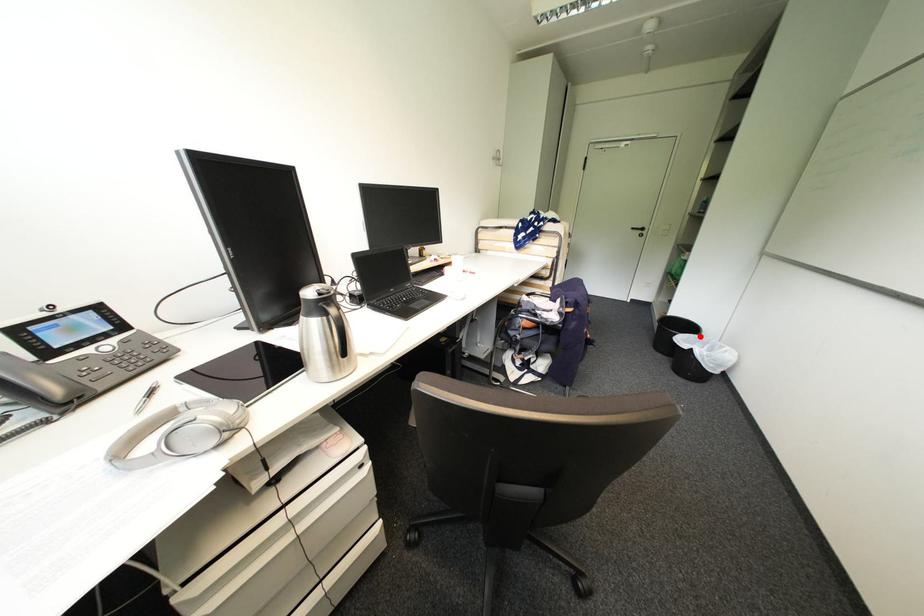
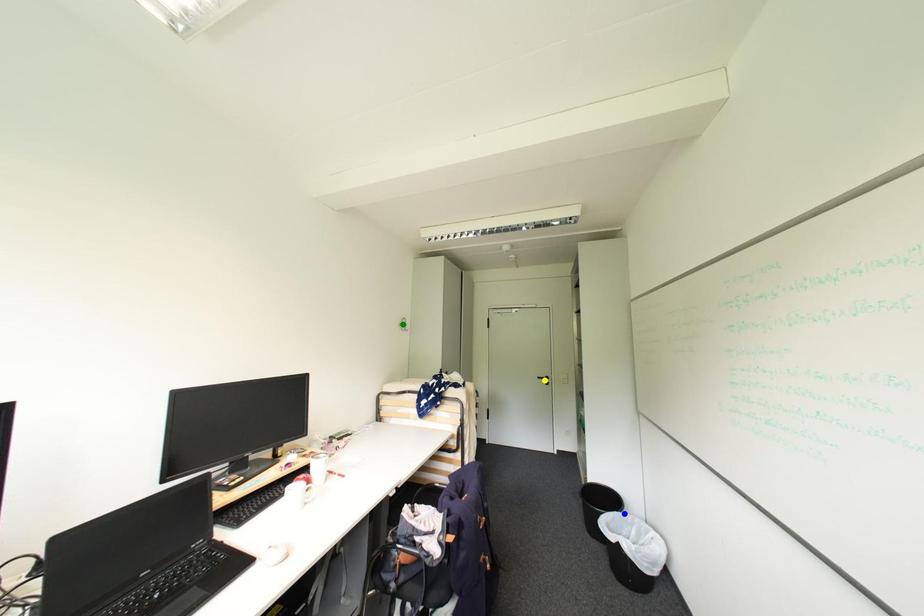
Question: I am providing you with two images of the same scene from different viewpoints. A red point is marked on the first image. You are given multiple points on the second image. Can you choose the point in image 2 that corresponds to the point in image 1?

Choices:
 (A) blue point
 (B) yellow point
 (C) green point

Answer: (A)